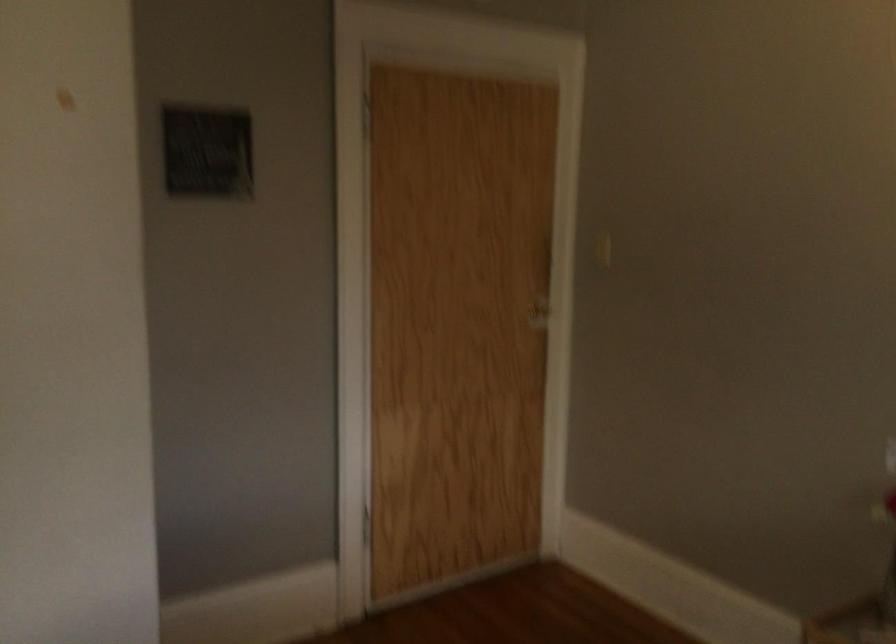
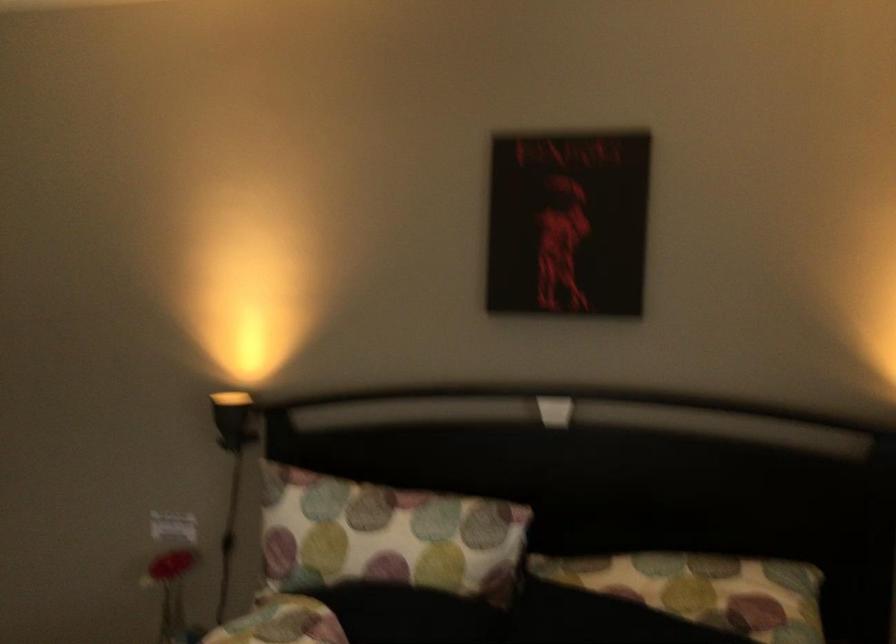
Question: Based on the continuous images, in which direction is the camera rotating? Reply with the corresponding letter.

Choices:
 (A) Left
 (B) Right
 (C) Up
 (D) Down

Answer: (B)